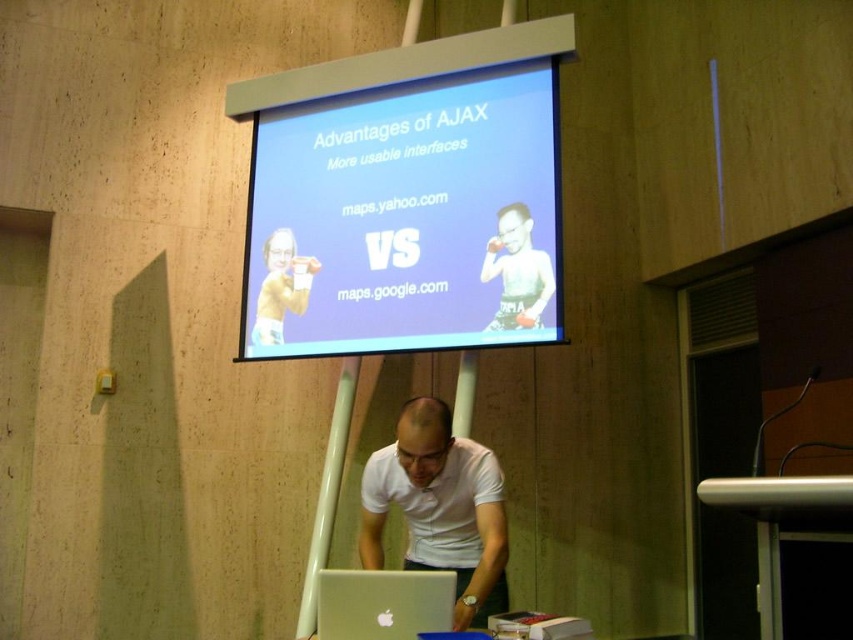
You are organizing a small event and need to place a laptop and some snacks on the metallic silver table at lower right and the matte white boxer at center. Considering their sizes, which object can accommodate both items without overcrowding?

The metallic silver table at lower right can accommodate both the laptop and snacks since it is bigger than the matte white boxer at center.

You are a presenter standing in front of the metallic silver table at lower right and the matte white boxer at center. You need to move a laptop from the table to the boxer. Which direction should you move it?

The metallic silver table at lower right is on the right side of the matte white boxer at center, so you should move the laptop from the right side to the center.